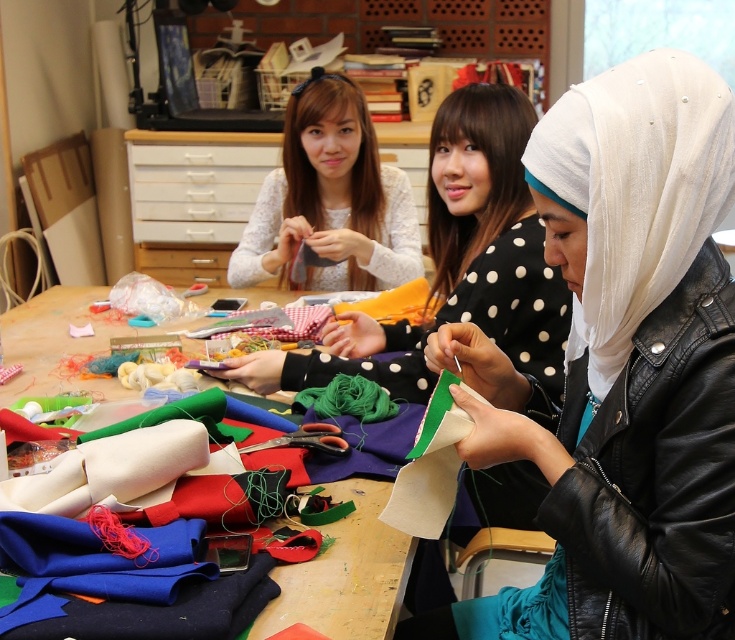
Question: Considering the real-world distances, which object is closest to the matte white hijab at upper right?

Choices:
 (A) fabric-covered table at center
 (B) green felt fabric at center
 (C) white leather jacket at center

Answer: (B)

Question: Based on their relative distances, which object is nearer to the white leather jacket at center?

Choices:
 (A) green felt fabric at center
 (B) matte white hijab at upper right

Answer: (A)

Question: Does white leather jacket at center have a smaller size compared to matte white hijab at upper right?

Choices:
 (A) yes
 (B) no

Answer: (A)

Question: Can you confirm if matte white hijab at upper right is positioned below white lace shirt at upper center?

Choices:
 (A) no
 (B) yes

Answer: (B)

Question: Can you confirm if white leather jacket at center is smaller than matte white hijab at upper right?

Choices:
 (A) yes
 (B) no

Answer: (A)

Question: Which of the following is the farthest from the observer?

Choices:
 (A) pyautogui.click(x=700, y=312)
 (B) pyautogui.click(x=481, y=273)
 (C) pyautogui.click(x=395, y=248)
 (D) pyautogui.click(x=354, y=627)

Answer: (C)